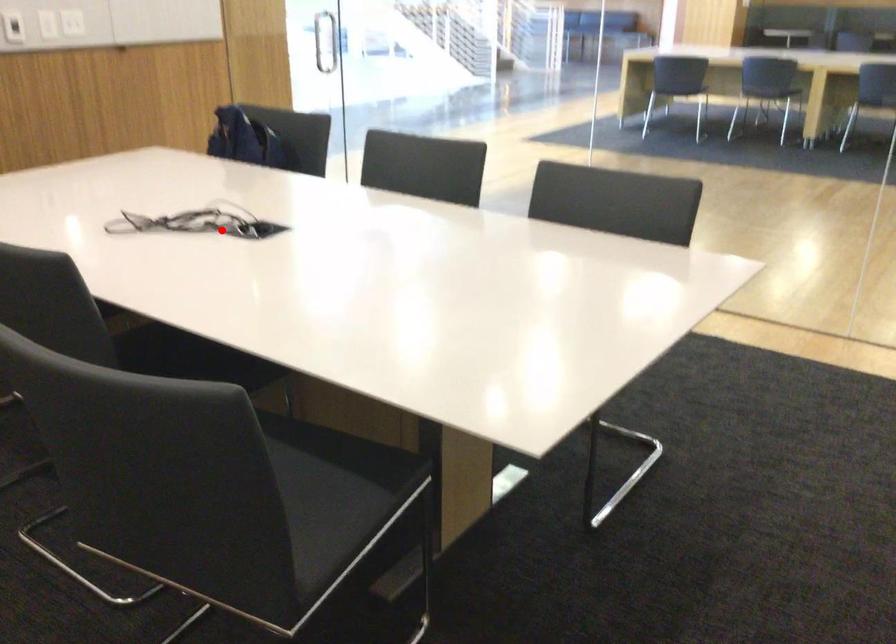
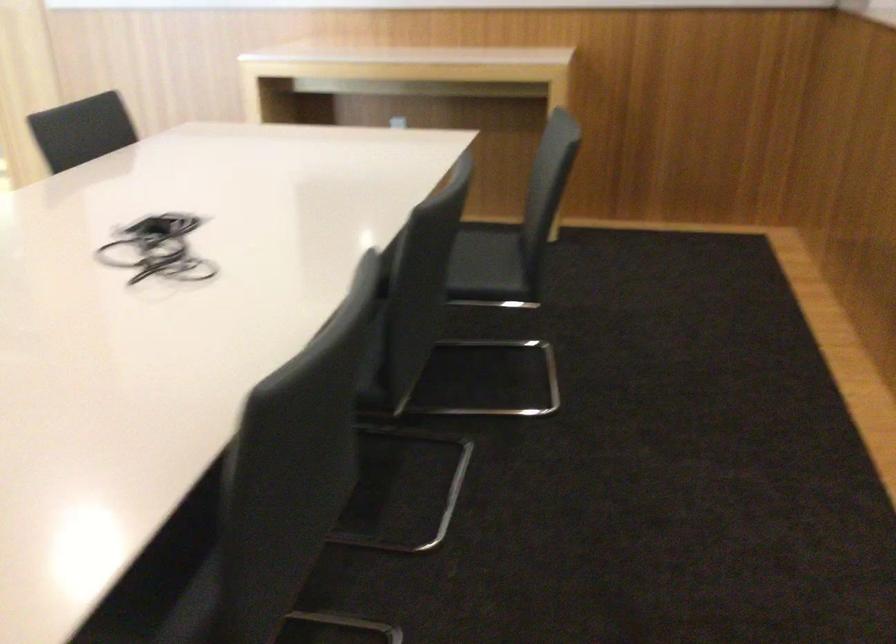
The point at the highlighted location is marked in the first image. Where is the corresponding point in the second image?

(158, 249)